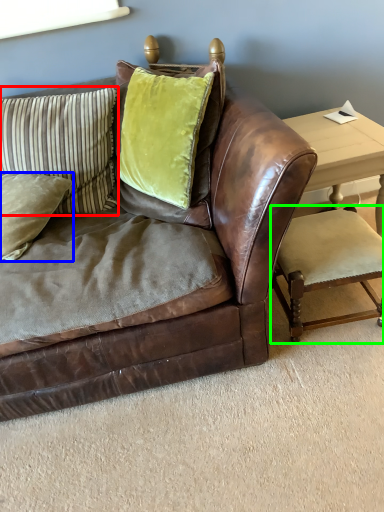
Question: Which object is the closest to the pillow (highlighted by a red box)? Choose among these: pillow (highlighted by a blue box) or armchair (highlighted by a green box).

Choices:
 (A) pillow
 (B) armchair

Answer: (A)